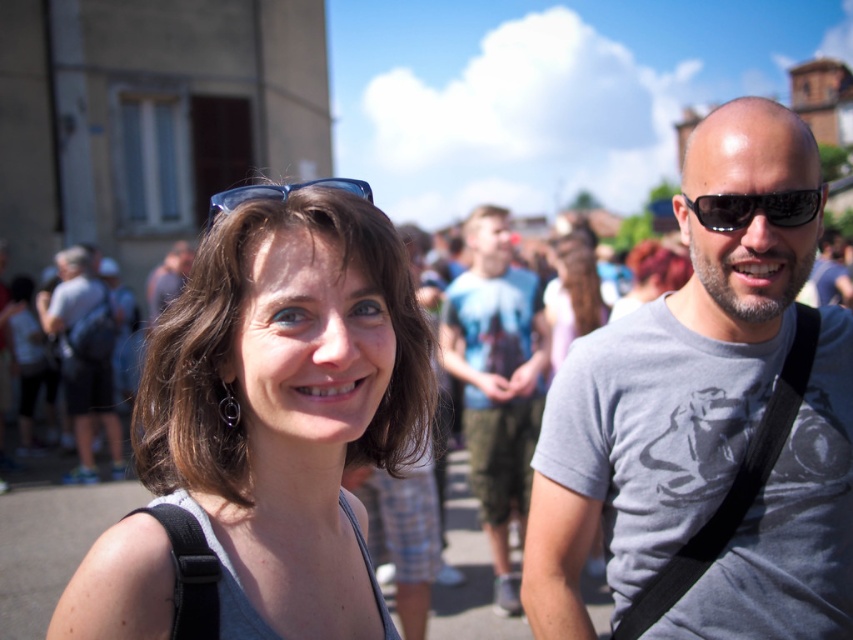
You are a photographer trying to capture a closeup of the matte gray tank top at center and the blue plastic sunglasses at upper center. Which object should you zoom in on more to ensure both are in focus?

The matte gray tank top at center is smaller than the blue plastic sunglasses at upper center, so you should zoom in more on the blue plastic sunglasses at upper center to ensure both are in focus.